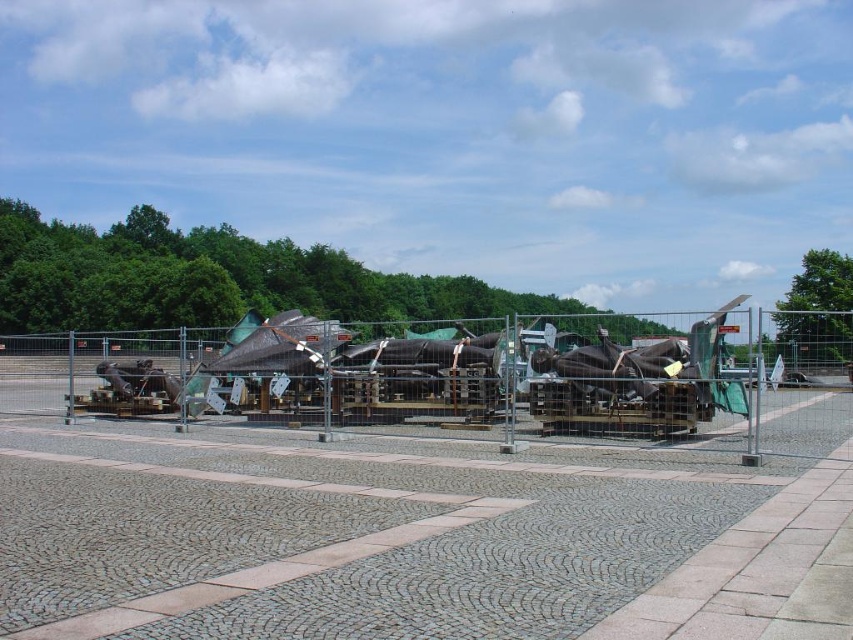
You are a delivery person trying to navigate through the cobblestone pavement at center and the metal wire fence at center. Which one has a narrower width?

The cobblestone pavement at center has a lesser width compared to the metal wire fence at center, so it is narrower.